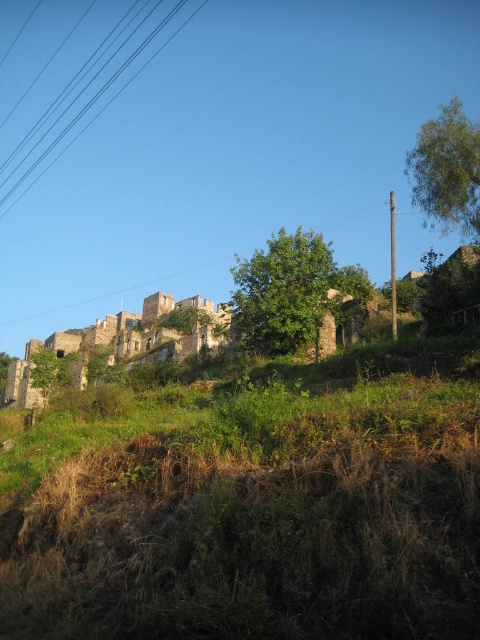
Where is `green grassy at upper left`? This screenshot has width=480, height=640. green grassy at upper left is located at coordinates (255, 506).

Is point (212, 486) closer to camera compared to point (144, 304)?

Yes.

At what (x,y) coordinates should I click in order to perform the action: click on green grassy at upper left. Please return your answer as a coordinate pair (x, y). Looking at the image, I should click on (255, 506).

From the picture: Does weathered stone castle at upper center have a smaller size compared to brown wooden power line at upper center?

No, weathered stone castle at upper center is not smaller than brown wooden power line at upper center.

The width and height of the screenshot is (480, 640). What do you see at coordinates (121, 342) in the screenshot? I see `weathered stone castle at upper center` at bounding box center [121, 342].

Who is more forward, (144, 300) or (181, 268)?

Point (144, 300)

In order to click on weathered stone castle at upper center in this screenshot , I will do `click(121, 342)`.

Does black wire at upper left appear on the left side of brown wooden power line at upper center?

Indeed, black wire at upper left is positioned on the left side of brown wooden power line at upper center.

Who is more forward, [152,26] or [338,224]?

Point [338,224] is in front.

Find the location of a particular element. The image size is (480, 640). black wire at upper left is located at coordinates (93, 90).